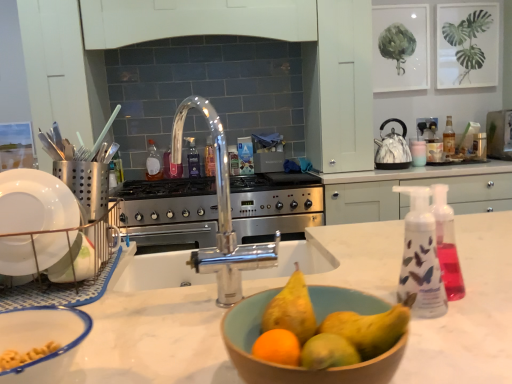
In order to face dark purple glass bottle at center, placed as the 2th bottle when sorted from right to left, should I rotate leftwards or rightwards?

It's best to rotate left around 8.669 degrees.

What is the approximate height of satin silver utensil holder at left, the 2th appliance when ordered from back to front?

It is 14.81 centimeters.

At what (x,y) coordinates should I click in order to perform the action: click on yellow matte pear at center, the second pear from the right. Please return your answer as a coordinate pair (x, y). This screenshot has height=384, width=512. Looking at the image, I should click on (291, 309).

Describe the element at coordinates (449, 138) in the screenshot. I see `translucent plastic bottle at right, the third bottle viewed from the left` at that location.

At what (x,y) coordinates should I click in order to perform the action: click on dark purple glass bottle at center, placed as the 2th bottle when sorted from right to left. Please return your answer as a coordinate pair (x, y). Looking at the image, I should click on (193, 159).

From a real-world perspective, which is physically above, yellow matte pear at center, the first pear positioned from the left, or satin silver utensil holder at left, acting as the 1th appliance starting from the bottom?

In real-world perspective, satin silver utensil holder at left, acting as the 1th appliance starting from the bottom, is above.

Where is `the 1st pear below when counting from the satin silver utensil holder at left, the 2th appliance viewed from the top (from the image's perspective)`? The width and height of the screenshot is (512, 384). the 1st pear below when counting from the satin silver utensil holder at left, the 2th appliance viewed from the top (from the image's perspective) is located at coordinates (291, 309).

Is yellow matte pear at center, the first pear positioned from the left, in front of or behind satin silver utensil holder at left, the 2th appliance viewed from the top, in the image?

In the image, yellow matte pear at center, the first pear positioned from the left, appears in front of satin silver utensil holder at left, the 2th appliance viewed from the top.

Does yellow matte pear at center, the second pear from the right, have a greater width compared to satin silver utensil holder at left, the 2th appliance viewed from the top?

No, yellow matte pear at center, the second pear from the right, is not wider than satin silver utensil holder at left, the 2th appliance viewed from the top.

Is white ceramic dish rack at left, the first kitchen appliance from the bottom, located within marble-patterned kettle at right, placed as the second kitchen appliance when sorted from front to back?

Definitely not — white ceramic dish rack at left, the first kitchen appliance from the bottom, is not inside marble-patterned kettle at right, placed as the second kitchen appliance when sorted from front to back.

Which is more to the left, marble-patterned kettle at right, the 2th kitchen appliance positioned from the bottom, or white ceramic dish rack at left, which appears as the first kitchen appliance when viewed from the front?

white ceramic dish rack at left, which appears as the first kitchen appliance when viewed from the front.

In terms of width, does marble-patterned kettle at right, placed as the second kitchen appliance when sorted from front to back, look wider or thinner when compared to white ceramic dish rack at left, which appears as the first kitchen appliance when viewed from the left?

Clearly, marble-patterned kettle at right, placed as the second kitchen appliance when sorted from front to back, has more width compared to white ceramic dish rack at left, which appears as the first kitchen appliance when viewed from the left.

Which is more to the right, dark purple glass bottle at center, placed as the 2th bottle when sorted from left to right, or translucent plastic bottle at center, acting as the first bottle starting from the left?

Positioned to the right is dark purple glass bottle at center, placed as the 2th bottle when sorted from left to right.

Between dark purple glass bottle at center, placed as the 2th bottle when sorted from right to left, and translucent plastic bottle at center, acting as the first bottle starting from the left, which one has less height?

With less height is dark purple glass bottle at center, placed as the 2th bottle when sorted from right to left.

Between dark purple glass bottle at center, placed as the 2th bottle when sorted from right to left, and translucent plastic bottle at center, acting as the first bottle starting from the left, which one is positioned in front?

translucent plastic bottle at center, acting as the first bottle starting from the left, is in front.

Measure the distance from translucent plastic bottle at right, the third bottle viewed from the left, to wooden bowl at center, which ranks as the 2th basin in left-to-right order.

7.67 feet.

Which is in front, point (449, 136) or point (256, 326)?

Positioned in front is point (256, 326).

Is translucent plastic bottle at right, the third bottle viewed from the left, facing towards wooden bowl at center, which ranks as the 2th basin in left-to-right order?

No.

Is translucent plastic bottle at right, the third bottle viewed from the left, inside the boundaries of wooden bowl at center, marked as the first basin in a right-to-left arrangement, or outside?

translucent plastic bottle at right, the third bottle viewed from the left, cannot be found inside wooden bowl at center, marked as the first basin in a right-to-left arrangement.

From the image's perspective, is dark purple glass bottle at center, placed as the 2th bottle when sorted from right to left, over white plastic bowl at lower left, placed as the second basin when sorted from right to left?

Yes, from the image's perspective, dark purple glass bottle at center, placed as the 2th bottle when sorted from right to left, is over white plastic bowl at lower left, placed as the second basin when sorted from right to left.

Considering the positions of objects dark purple glass bottle at center, placed as the 2th bottle when sorted from right to left, and white plastic bowl at lower left, placed as the second basin when sorted from right to left, in the image provided, who is behind, dark purple glass bottle at center, placed as the 2th bottle when sorted from right to left, or white plastic bowl at lower left, placed as the second basin when sorted from right to left,?

dark purple glass bottle at center, placed as the 2th bottle when sorted from right to left, is behind.

Where is `the 1st basin directly beneath the dark purple glass bottle at center, placed as the 2th bottle when sorted from left to right (from a real-world perspective)`? This screenshot has height=384, width=512. the 1st basin directly beneath the dark purple glass bottle at center, placed as the 2th bottle when sorted from left to right (from a real-world perspective) is located at coordinates (42, 341).

In the scene shown: Would you say white plastic bowl at lower left, positioned as the 1th basin in left-to-right order, is part of dark purple glass bottle at center, placed as the 2th bottle when sorted from left to right,'s contents?

Actually, white plastic bowl at lower left, positioned as the 1th basin in left-to-right order, is outside dark purple glass bottle at center, placed as the 2th bottle when sorted from left to right.

Could you tell me if translucent plastic bottle at center, marked as the 3th bottle in a right-to-left arrangement, is facing wooden bowl at center, marked as the first basin in a right-to-left arrangement?

Yes, translucent plastic bottle at center, marked as the 3th bottle in a right-to-left arrangement, is facing wooden bowl at center, marked as the first basin in a right-to-left arrangement.

Is wooden bowl at center, marked as the first basin in a right-to-left arrangement, a part of translucent plastic bottle at center, marked as the 3th bottle in a right-to-left arrangement?

No, wooden bowl at center, marked as the first basin in a right-to-left arrangement, is located outside of translucent plastic bottle at center, marked as the 3th bottle in a right-to-left arrangement.

Who is bigger, translucent plastic bottle at center, acting as the first bottle starting from the left, or wooden bowl at center, marked as the first basin in a right-to-left arrangement?

wooden bowl at center, marked as the first basin in a right-to-left arrangement, is bigger.

Is there a large distance between dark purple glass bottle at center, placed as the 2th bottle when sorted from left to right, and yellow matte pear at center, the first pear positioned from the left?

Yes, dark purple glass bottle at center, placed as the 2th bottle when sorted from left to right, and yellow matte pear at center, the first pear positioned from the left, are located far from each other.

Which is less distant, [189,148] or [308,297]?

Point [189,148] appears to be farther away from the viewer than point [308,297].

Which of these two, dark purple glass bottle at center, placed as the 2th bottle when sorted from right to left, or yellow matte pear at center, the second pear from the right, is thinner?

Thinner between the two is dark purple glass bottle at center, placed as the 2th bottle when sorted from right to left.

Is dark purple glass bottle at center, placed as the 2th bottle when sorted from right to left, to the right of yellow matte pear at center, the second pear from the right, from the viewer's perspective?

In fact, dark purple glass bottle at center, placed as the 2th bottle when sorted from right to left, is to the left of yellow matte pear at center, the second pear from the right.

Locate an element on the screen. This screenshot has width=512, height=384. the 1st pear in front of the satin silver utensil holder at left, placed as the 2th appliance when sorted from right to left, starting your count from the anchor is located at coordinates (291, 309).

Locate an element on the screen. The width and height of the screenshot is (512, 384). kitchen appliance behind the white ceramic dish rack at left, the first kitchen appliance from the bottom is located at coordinates (392, 148).

Considering their positions, is wooden bowl at center, which ranks as the 2th basin in left-to-right order, positioned further to satin silver utensil holder at left, placed as the 2th appliance when sorted from right to left, than yellow matte pear at center, which is the second pear in left-to-right order?

yellow matte pear at center, which is the second pear in left-to-right order, lies further to satin silver utensil holder at left, placed as the 2th appliance when sorted from right to left, than the other object.

When comparing their distances from translucent plastic bottle at right, the first bottle viewed from the right, does white plastic bowl at lower left, placed as the second basin when sorted from right to left, or satin silver utensil holder at left, placed as the 2th appliance when sorted from right to left, seem further?

white plastic bowl at lower left, placed as the second basin when sorted from right to left, is further to translucent plastic bottle at right, the first bottle viewed from the right.

When comparing their distances from yellow matte pear at center, which is the second pear in left-to-right order, does yellow matte pear at center, the second pear from the right, or translucent plastic bottle at center, marked as the 3th bottle in a right-to-left arrangement, seem closer?

yellow matte pear at center, the second pear from the right, lies closer to yellow matte pear at center, which is the second pear in left-to-right order, than the other object.

From the image, which object appears to be farther from white plastic bowl at lower left, positioned as the 1th basin in left-to-right order, translucent plastic bottle at right, the third bottle viewed from the left, or satin silver utensil holder at left, acting as the 1th appliance starting from the bottom?

translucent plastic bottle at right, the third bottle viewed from the left, is further to white plastic bowl at lower left, positioned as the 1th basin in left-to-right order.

From the image, which object appears to be nearer to marble-patterned kettle at right, which is counted as the first kitchen appliance, starting from the top, white plastic bowl at lower left, positioned as the 1th basin in left-to-right order, or white ceramic dish rack at left, which appears as the first kitchen appliance when viewed from the left?

The object closer to marble-patterned kettle at right, which is counted as the first kitchen appliance, starting from the top, is white ceramic dish rack at left, which appears as the first kitchen appliance when viewed from the left.

Based on their spatial positions, is yellow matte pear at center, which is the second pear in left-to-right order, or metallic silver toaster at upper right, which is counted as the second appliance, starting from the front, further from marble-patterned kettle at right, positioned as the first kitchen appliance in back-to-front order?

yellow matte pear at center, which is the second pear in left-to-right order, lies further to marble-patterned kettle at right, positioned as the first kitchen appliance in back-to-front order, than the other object.

Estimate the real-world distances between objects in this image. Which object is closer to translucent plastic bottle at right, the third bottle viewed from the left, translucent plastic bottle at center, marked as the 3th bottle in a right-to-left arrangement, or white plastic bowl at lower left, positioned as the 1th basin in left-to-right order?

Based on the image, translucent plastic bottle at center, marked as the 3th bottle in a right-to-left arrangement, appears to be nearer to translucent plastic bottle at right, the third bottle viewed from the left.

From the image, which object appears to be farther from yellow matte pear at center, the first pear positioned from the left, dark purple glass bottle at center, placed as the 2th bottle when sorted from left to right, or yellow matte pear at center, which is the second pear in left-to-right order?

Among the two, dark purple glass bottle at center, placed as the 2th bottle when sorted from left to right, is located further to yellow matte pear at center, the first pear positioned from the left.

Identify the location of cabinetry located between yellow matte pear at center, the 1th pear viewed from the right, and translucent plastic bottle at right, the first bottle viewed from the right, in the depth direction. The image size is (512, 384). (339, 87).

Locate an element on the screen. appliance located between yellow matte pear at center, the first pear positioned from the left, and white matte cabinet at upper right in the depth direction is located at coordinates (86, 184).

The image size is (512, 384). I want to click on bottle between white matte cabinet at upper right and metallic silver toaster at upper right, the first appliance from the top, in the horizontal direction, so pyautogui.click(x=449, y=138).

This screenshot has width=512, height=384. I want to click on basin between white ceramic dish rack at left, which ranks as the 2th kitchen appliance in right-to-left order, and wooden bowl at center, marked as the first basin in a right-to-left arrangement, in the horizontal direction, so click(x=42, y=341).